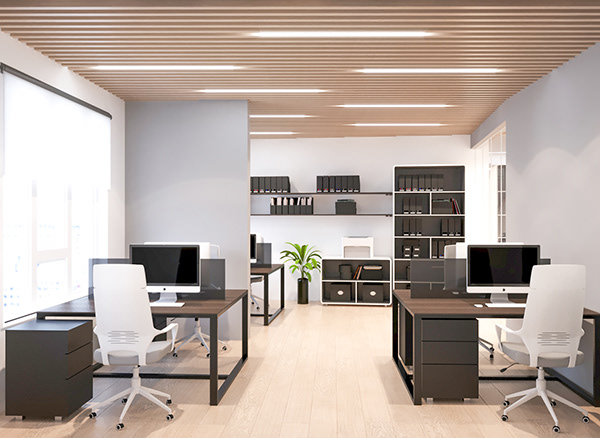
This screenshot has height=438, width=600. What are the coordinates of `file cabinet` in the screenshot? It's located at (438, 385), (26, 392), (406, 341), (158, 319).